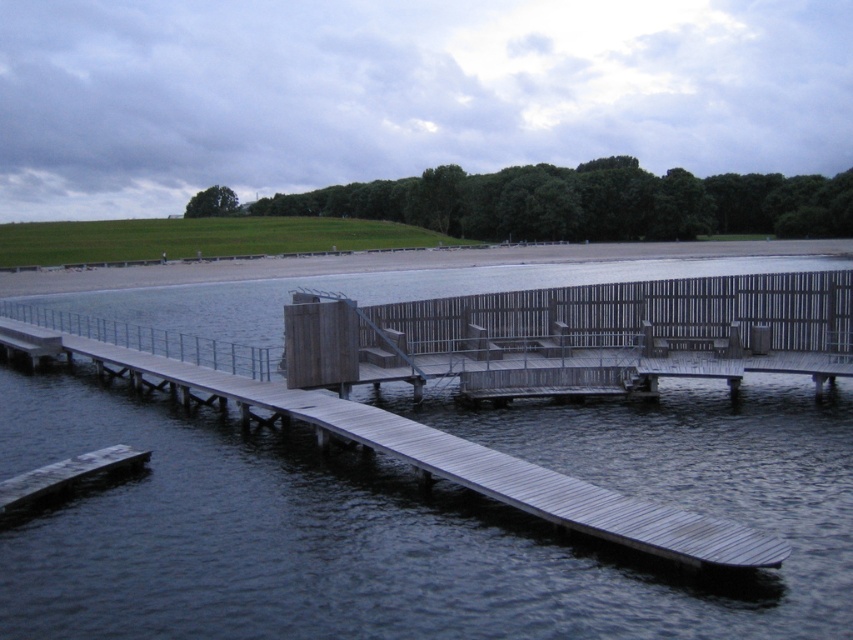
You are standing at the point labeled as point (440, 456) in the image. What structure are you currently on?

You are standing on the wooden dock at center.

You are standing on the wooden dock at center and want to move to the smooth wooden dock at lower left. Which direction should you walk to reach it?

The wooden dock at center is positioned on the left side of smooth wooden dock at lower left. Therefore, you should walk to the right to reach the smooth wooden dock at lower left from the wooden dock at center.